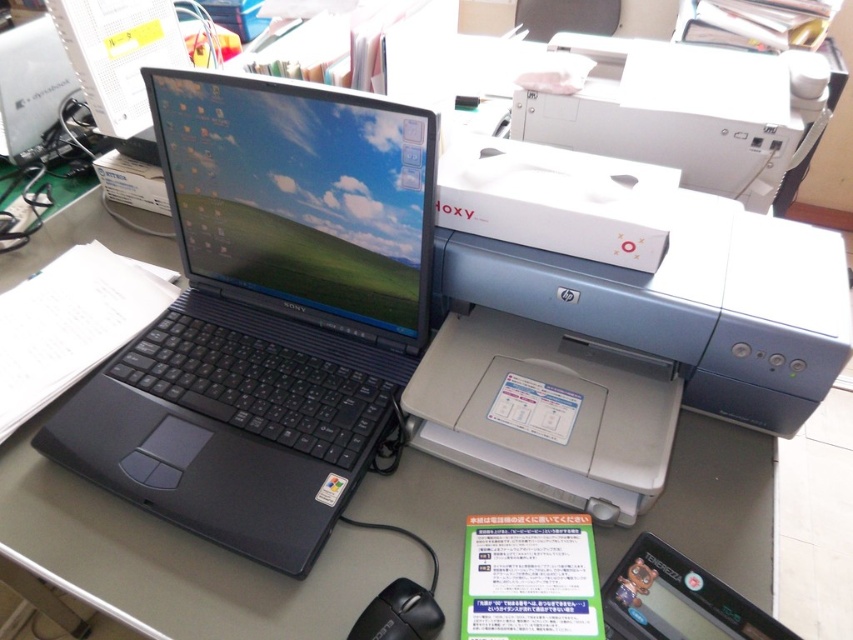
You are organizing your desk and need to move the matte black laptop at upper left closer to the white glossy printer at upper right. Which direction should you move the laptop?

You should move the matte black laptop at upper left to the right to bring it closer to the white glossy printer at upper right since the printer is located to the right of the laptop.